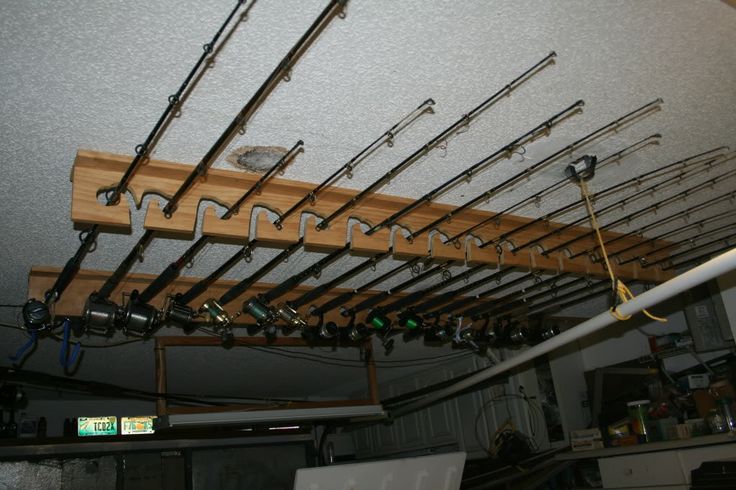
The height and width of the screenshot is (490, 736). I want to click on wall, so click(x=614, y=353), click(x=434, y=418).